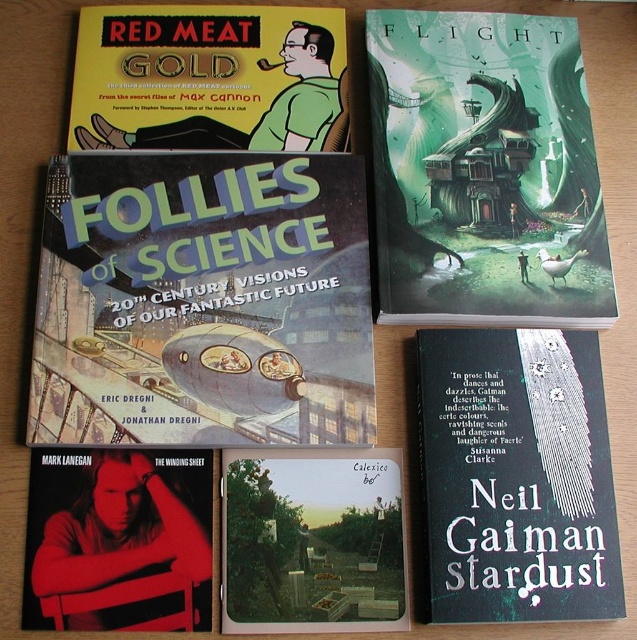
Which object is larger in size between the green matte house at upper center and the matte yellow book at upper left?

The green matte house at upper center is bigger than the matte yellow book at upper left.

You are organizing a bookshelf and need to place the matte blue book at center and the green matte house at upper center. Which book should you place first if you want to ensure both fit on the shelf without overlapping?

You should place the matte blue book at center first because it is larger than the green matte house at upper center, so positioning it first ensures there is enough space for both.